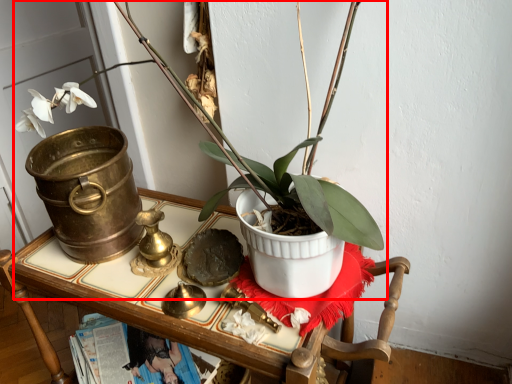
Question: Considering the relative positions of houseplant (annotated by the red box) and furniture in the image provided, where is houseplant (annotated by the red box) located with respect to the staircase?

Choices:
 (A) left
 (B) right

Answer: (B)